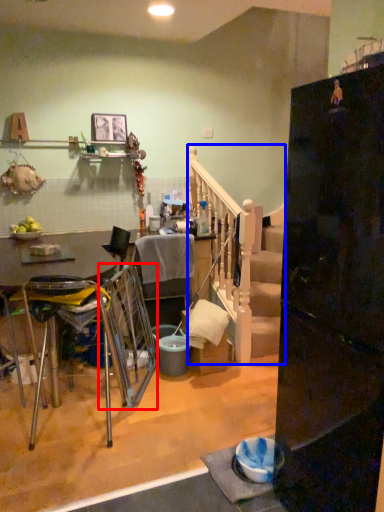
Question: Which object is closer to the camera taking this photo, swivel chair (highlighted by a red box) or rail (highlighted by a blue box)?

Choices:
 (A) swivel chair
 (B) rail

Answer: (A)